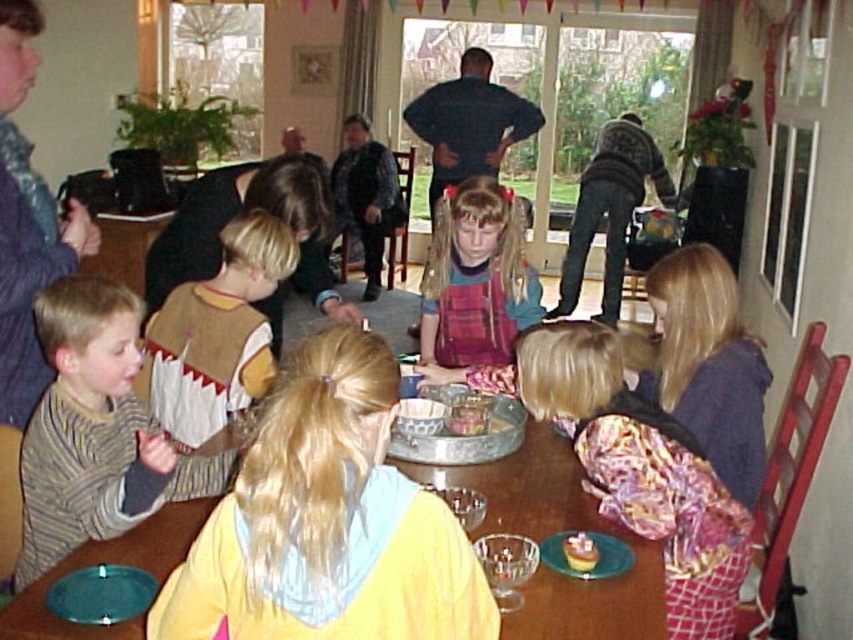
Question: Which object is positioned farthest from the dark blue shirt at upper center?

Choices:
 (A) floral fabric dress at lower right
 (B) plaid fabric dress at center
 (C) striped cotton shirt at lower left
 (D) wooden table at center

Answer: (C)

Question: Does wooden table at center appear under dark blue shirt at upper center?

Choices:
 (A) yes
 (B) no

Answer: (A)

Question: Which object appears closest to the camera in this image?

Choices:
 (A) striped cotton shirt at lower left
 (B) dark blue shirt at upper center
 (C) brown felt vest at left
 (D) smooth white cake at lower center

Answer: (A)

Question: Considering the relative positions of floral fabric dress at lower right and smooth white cake at lower center in the image provided, where is floral fabric dress at lower right located with respect to smooth white cake at lower center?

Choices:
 (A) left
 (B) right

Answer: (B)

Question: Is floral fabric dress at lower right to the right of wooden table at center from the viewer's perspective?

Choices:
 (A) yes
 (B) no

Answer: (A)

Question: Among these objects, which one is farthest from the camera?

Choices:
 (A) brown felt vest at left
 (B) wooden table at center

Answer: (A)